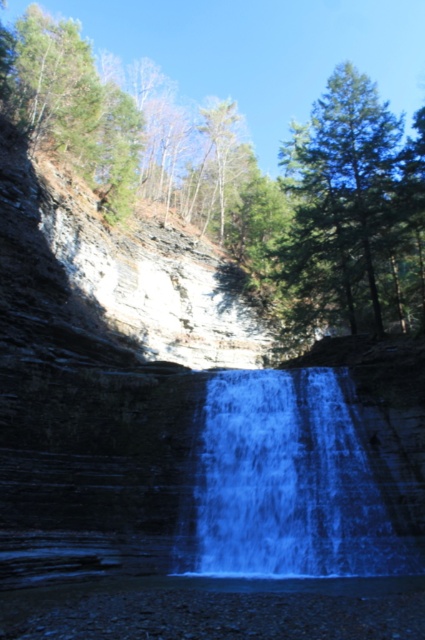
Question: Can you confirm if blue translucent water at center is wider than green matte tree at upper right?

Choices:
 (A) no
 (B) yes

Answer: (B)

Question: Estimate the real-world distances between objects in this image. Which object is farther from the blue translucent water at center?

Choices:
 (A) green leafy tree at upper center
 (B) green matte tree at upper right

Answer: (A)

Question: Is blue translucent water at center below green matte tree at upper right?

Choices:
 (A) yes
 (B) no

Answer: (A)

Question: Is blue translucent water at center positioned in front of green matte tree at upper right?

Choices:
 (A) yes
 (B) no

Answer: (A)

Question: Which object is the closest to the green matte tree at upper right?

Choices:
 (A) green leafy tree at upper center
 (B) blue translucent water at center

Answer: (A)

Question: Which point is farther to the camera?

Choices:
 (A) (334, 381)
 (B) (374, 280)
 (C) (102, 144)

Answer: (C)